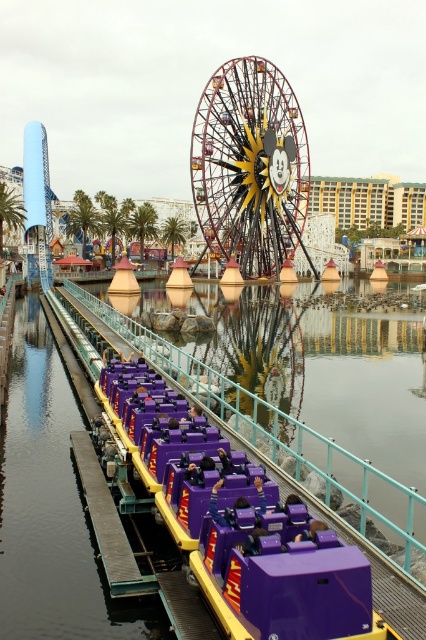
The image size is (426, 640). I want to click on metallic yellow ferris wheel at center, so click(250, 166).

Which of these two, metallic yellow ferris wheel at center or purple plastic waterway at center, stands shorter?

Standing shorter between the two is purple plastic waterway at center.

This screenshot has width=426, height=640. What are the coordinates of `metallic yellow ferris wheel at center` in the screenshot? It's located at [250, 166].

Where is `purple plastic waterway at center`? purple plastic waterway at center is located at coordinates (285, 440).

Does point (279, 422) lie in front of point (190, 579)?

No, (279, 422) is behind (190, 579).

Find the location of a particular element. Image resolution: width=426 pixels, height=640 pixels. purple plastic waterway at center is located at coordinates (285, 440).

Who is more distant from viewer, (230,179) or (115,547)?

Positioned behind is point (230,179).

Can you confirm if metallic yellow ferris wheel at center is smaller than smooth gray dock at lower left?

Incorrect, metallic yellow ferris wheel at center is not smaller in size than smooth gray dock at lower left.

Does point (278, 161) come closer to viewer compared to point (106, 506)?

No.

Identify the location of metallic yellow ferris wheel at center. This screenshot has width=426, height=640. (250, 166).